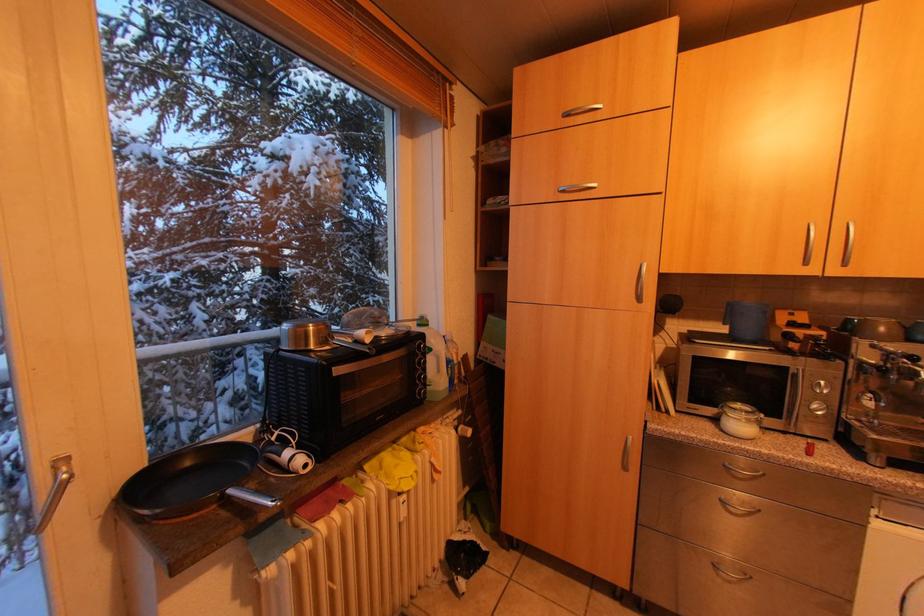
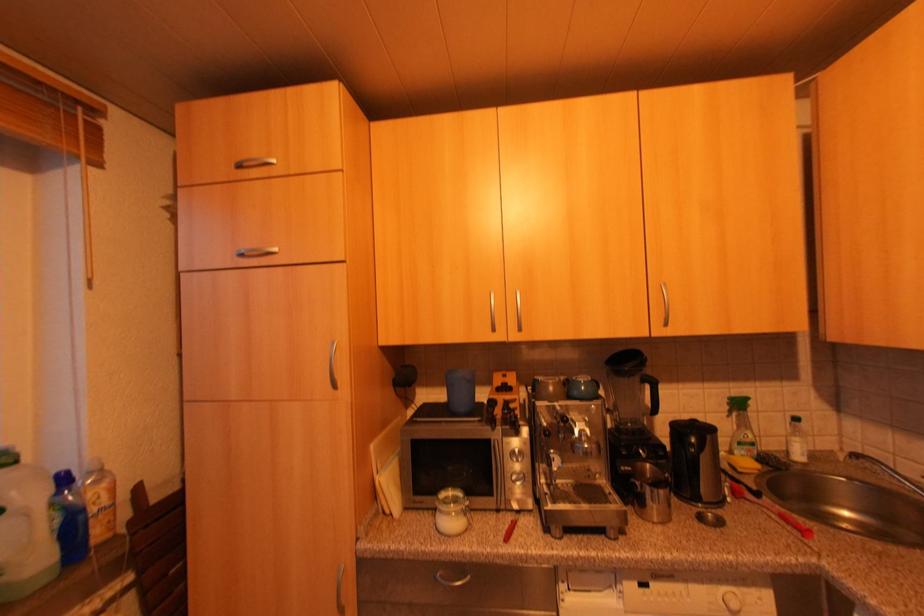
Question: In a continuous first-person perspective shot, in which direction is the camera moving?

Choices:
 (A) Left
 (B) Right
 (C) Forward
 (D) Backward

Answer: (B)